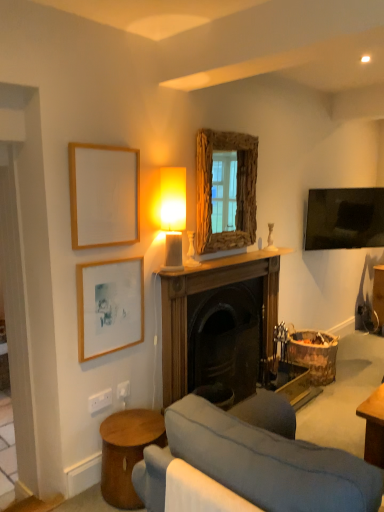
Measure the distance between point (204, 236) and camera.

Point (204, 236) and camera are 2.83 meters apart.

Describe the element at coordinates (236, 189) in the screenshot. I see `rustic wood mirror at upper center` at that location.

I want to click on matte wooden picture frame at upper left, which is the 1th picture frame from top to bottom, so click(x=104, y=195).

What do you see at coordinates (127, 452) in the screenshot? Image resolution: width=384 pixels, height=512 pixels. I see `wooden side table at lower left` at bounding box center [127, 452].

Describe the element at coordinates (257, 464) in the screenshot. The height and width of the screenshot is (512, 384). I see `velvet grey couch at lower center` at that location.

The height and width of the screenshot is (512, 384). What do you see at coordinates (173, 214) in the screenshot?
I see `matte white table lamp at upper center` at bounding box center [173, 214].

Image resolution: width=384 pixels, height=512 pixels. What do you see at coordinates (109, 306) in the screenshot?
I see `wooden picture frame at lower left, which ranks as the 2th picture frame in top-to-bottom order` at bounding box center [109, 306].

Find the location of a particular element. rustic wood mirror at upper center is located at coordinates (236, 189).

From a real-world perspective, is wooden side table at lower left physically above wooden fireplace at center?

No, from a real-world perspective, wooden side table at lower left is not on top of wooden fireplace at center.

Which object is further away from the camera, wooden side table at lower left or wooden fireplace at center?

wooden fireplace at center.

Which of these two, wooden side table at lower left or wooden fireplace at center, is smaller?

Smaller between the two is wooden side table at lower left.

From the image's perspective, is wooden side table at lower left above or below wooden fireplace at center?

wooden side table at lower left is situated lower than wooden fireplace at center in the image.

Considering the positions of objects wooden picture frame at lower left, positioned as the 1th picture frame in bottom-to-top order, and matte white table lamp at upper center in the image provided, who is in front, wooden picture frame at lower left, positioned as the 1th picture frame in bottom-to-top order, or matte white table lamp at upper center?

wooden picture frame at lower left, positioned as the 1th picture frame in bottom-to-top order, is more forward.

Considering the relative positions of wooden picture frame at lower left, positioned as the 1th picture frame in bottom-to-top order, and matte white table lamp at upper center in the image provided, is wooden picture frame at lower left, positioned as the 1th picture frame in bottom-to-top order, to the left of matte white table lamp at upper center from the viewer's perspective?

Yes, wooden picture frame at lower left, positioned as the 1th picture frame in bottom-to-top order, is to the left of matte white table lamp at upper center.

From the picture: Is wooden picture frame at lower left, positioned as the 1th picture frame in bottom-to-top order, positioned beyond the bounds of matte white table lamp at upper center?

wooden picture frame at lower left, positioned as the 1th picture frame in bottom-to-top order, lies outside matte white table lamp at upper center's area.

From a real-world perspective, which object stands above the other?

matte white table lamp at upper center.

Considering the sizes of objects rustic wood mirror at upper center and matte white table lamp at upper center in the image provided, who is wider, rustic wood mirror at upper center or matte white table lamp at upper center?

matte white table lamp at upper center is wider.

From the image's perspective, who appears lower, rustic wood mirror at upper center or matte white table lamp at upper center?

matte white table lamp at upper center, from the image's perspective.

Does point (217, 248) lie behind point (169, 221)?

Yes, it is behind point (169, 221).

Can you tell me how much rustic wood mirror at upper center and matte white table lamp at upper center differ in facing direction?

The angular difference between rustic wood mirror at upper center and matte white table lamp at upper center is 0.000733 degrees.

From the image's perspective, is wooden picture frame at lower left, positioned as the 1th picture frame in bottom-to-top order, over matte wooden picture frame at upper left, which is the 1th picture frame from top to bottom?

Incorrect, from the image's perspective, wooden picture frame at lower left, positioned as the 1th picture frame in bottom-to-top order, is lower than matte wooden picture frame at upper left, which is the 1th picture frame from top to bottom.

Consider the image. Which point is more forward, (114, 332) or (129, 160)?

The point (129, 160) is closer to the camera.

Can you confirm if wooden picture frame at lower left, which ranks as the 2th picture frame in top-to-bottom order, is shorter than matte wooden picture frame at upper left, the second picture frame positioned from the bottom?

Yes.

Is wooden picture frame at lower left, positioned as the 1th picture frame in bottom-to-top order, oriented away from matte wooden picture frame at upper left, which is the 1th picture frame from top to bottom?

No, wooden picture frame at lower left, positioned as the 1th picture frame in bottom-to-top order, is not facing away from matte wooden picture frame at upper left, which is the 1th picture frame from top to bottom.

Considering their positions, is velvet grey couch at lower center located in front of or behind wooden picture frame at lower left, which ranks as the 2th picture frame in top-to-bottom order?

velvet grey couch at lower center is positioned closer to the viewer than wooden picture frame at lower left, which ranks as the 2th picture frame in top-to-bottom order.

Can you tell me how much velvet grey couch at lower center and wooden picture frame at lower left, which ranks as the 2th picture frame in top-to-bottom order, differ in facing direction?

There is a 90-degree angle between the facing directions of velvet grey couch at lower center and wooden picture frame at lower left, which ranks as the 2th picture frame in top-to-bottom order.

Which object is positioned more to the right, velvet grey couch at lower center or wooden picture frame at lower left, which ranks as the 2th picture frame in top-to-bottom order?

From the viewer's perspective, velvet grey couch at lower center appears more on the right side.

Image resolution: width=384 pixels, height=512 pixels. Find the location of `window screen that appears behind the matte wooden picture frame at upper left, which is the 1th picture frame from top to bottom`. window screen that appears behind the matte wooden picture frame at upper left, which is the 1th picture frame from top to bottom is located at coordinates (236, 189).

Is point (239, 197) less distant than point (116, 180)?

No, it is behind (116, 180).

Who is smaller, rustic wood mirror at upper center or matte wooden picture frame at upper left, the second picture frame positioned from the bottom?

matte wooden picture frame at upper left, the second picture frame positioned from the bottom, is smaller.

Could you tell me if rustic wood mirror at upper center is turned towards matte wooden picture frame at upper left, the second picture frame positioned from the bottom?

No, rustic wood mirror at upper center is not aimed at matte wooden picture frame at upper left, the second picture frame positioned from the bottom.

Is wooden fireplace at center behind wooden side table at lower left?

Yes, wooden fireplace at center is further from the viewer.

Would you say wooden fireplace at center is to the left or to the right of wooden side table at lower left in the picture?

wooden fireplace at center is positioned on wooden side table at lower left's right side.

From the image's perspective, is wooden fireplace at center located above or below wooden side table at lower left?

Clearly, from the image's perspective, wooden fireplace at center is above wooden side table at lower left.

I want to click on fireplace behind the wooden side table at lower left, so click(202, 295).

Identify the location of picture frame below the matte white table lamp at upper center (from the image's perspective). (109, 306).

Considering their positions, is velvet grey couch at lower center positioned closer to wooden fireplace at center than matte wooden picture frame at upper left, which is the 1th picture frame from top to bottom?

matte wooden picture frame at upper left, which is the 1th picture frame from top to bottom, is positioned closer to the anchor wooden fireplace at center.

Considering their positions, is matte wooden picture frame at upper left, which is the 1th picture frame from top to bottom, positioned further to wooden side table at lower left than wooden picture frame at lower left, positioned as the 1th picture frame in bottom-to-top order?

The object further to wooden side table at lower left is matte wooden picture frame at upper left, which is the 1th picture frame from top to bottom.

When comparing their distances from wooden picture frame at lower left, positioned as the 1th picture frame in bottom-to-top order, does matte wooden picture frame at upper left, the second picture frame positioned from the bottom, or rustic wood mirror at upper center seem closer?

matte wooden picture frame at upper left, the second picture frame positioned from the bottom.

Considering their positions, is rustic wood mirror at upper center positioned further to wooden side table at lower left than matte white table lamp at upper center?

Based on the image, rustic wood mirror at upper center appears to be further to wooden side table at lower left.

Based on their spatial positions, is wooden picture frame at lower left, which ranks as the 2th picture frame in top-to-bottom order, or matte wooden picture frame at upper left, which is the 1th picture frame from top to bottom, closer to rustic wood mirror at upper center?

matte wooden picture frame at upper left, which is the 1th picture frame from top to bottom, is closer to rustic wood mirror at upper center.

Which object lies nearer to the anchor point velvet grey couch at lower center, wooden picture frame at lower left, positioned as the 1th picture frame in bottom-to-top order, or matte wooden picture frame at upper left, which is the 1th picture frame from top to bottom?

Among the two, wooden picture frame at lower left, positioned as the 1th picture frame in bottom-to-top order, is located nearer to velvet grey couch at lower center.

Considering their positions, is velvet grey couch at lower center positioned closer to rustic wood mirror at upper center than matte wooden picture frame at upper left, the second picture frame positioned from the bottom?

matte wooden picture frame at upper left, the second picture frame positioned from the bottom, is positioned closer to the anchor rustic wood mirror at upper center.

Looking at the image, which one is located closer to wooden side table at lower left, wooden fireplace at center or matte wooden picture frame at upper left, the second picture frame positioned from the bottom?

wooden fireplace at center is closer to wooden side table at lower left.

Identify the location of fireplace between matte wooden picture frame at upper left, which is the 1th picture frame from top to bottom, and wooden side table at lower left from top to bottom. The height and width of the screenshot is (512, 384). (202, 295).

What are the coordinates of `table between velvet grey couch at lower center and rustic wood mirror at upper center in the front-back direction` in the screenshot? It's located at (127, 452).

I want to click on picture frame that lies between matte white table lamp at upper center and wooden side table at lower left from top to bottom, so click(x=109, y=306).

Find the location of a particular element. table lamp between rustic wood mirror at upper center and wooden fireplace at center vertically is located at coordinates 173,214.